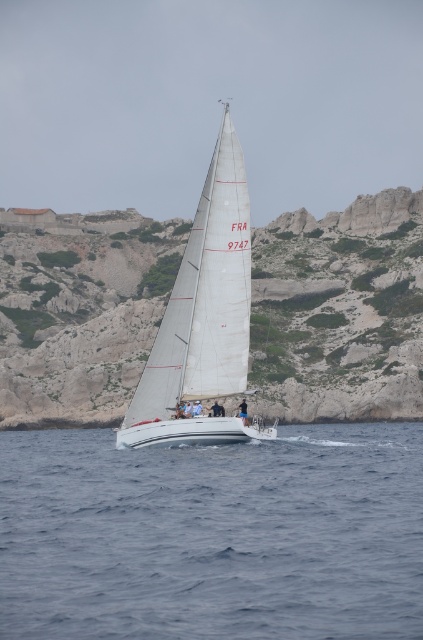
Consider the image. You are a sailor navigating a boat and you see the rocky cliff at center and the white sail at center in the distance. Which object is positioned lower in the scene?

The rocky cliff at center is positioned below the white sail at center, so the rocky cliff at center is lower.

You are standing on the deck of the sailboat with registration FRA 9747 and want to know the distance between your current position and the point marked at coordinates (288, 308) in the image. Can you determine this distance?

The distance between the point marked at coordinates (288, 308) and the camera is 159.02 meters, so the distance between your current position and that point is 159.02 meters.